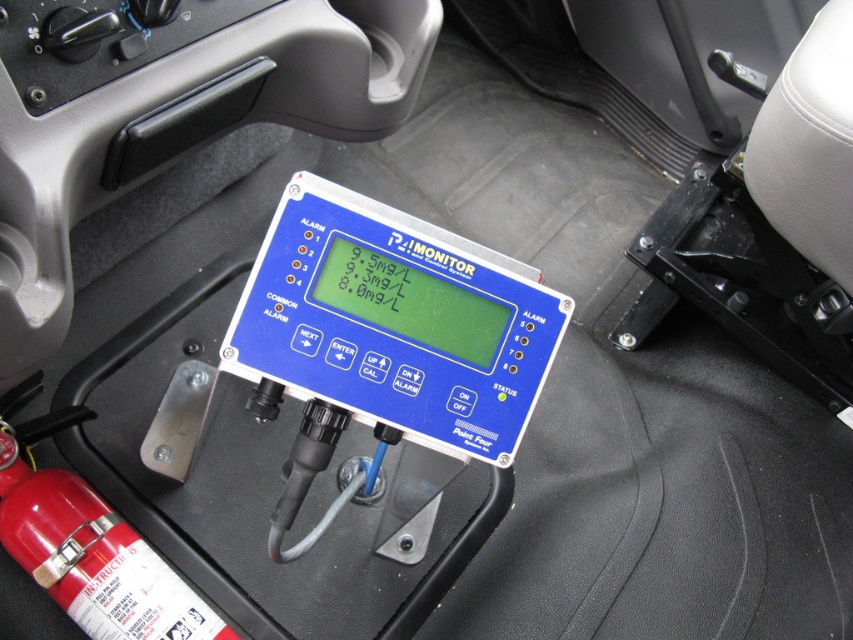
Can you confirm if blue plastic monitor at center is thinner than red matte fire extinguisher at lower left?

Incorrect, blue plastic monitor at center's width is not less than red matte fire extinguisher at lower left's.

Between blue plastic monitor at center and red matte fire extinguisher at lower left, which one appears on the right side from the viewer's perspective?

blue plastic monitor at center

Where is `blue plastic monitor at center`? blue plastic monitor at center is located at coordinates (392, 342).